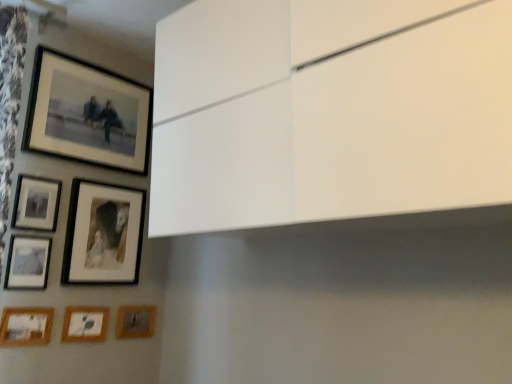
Question: Is matte black picture frame at upper left, the sixth picture frame ordered from the bottom, thinner than wooden matte picture frame at lower left, the second picture frame ordered from the bottom?

Choices:
 (A) yes
 (B) no

Answer: (B)

Question: Considering the relative positions of matte black picture frame at upper left, the sixth picture frame ordered from the bottom, and wooden matte picture frame at lower left, the second picture frame ordered from the bottom, in the image provided, is matte black picture frame at upper left, the sixth picture frame ordered from the bottom, to the right of wooden matte picture frame at lower left, the second picture frame ordered from the bottom, from the viewer's perspective?

Choices:
 (A) no
 (B) yes

Answer: (A)

Question: Is matte black picture frame at upper left, positioned as the second picture frame in top-to-bottom order, closer to the viewer compared to wooden matte picture frame at lower left, which ranks as the sixth picture frame in top-to-bottom order?

Choices:
 (A) no
 (B) yes

Answer: (B)

Question: Considering the relative sizes of matte black picture frame at upper left, the sixth picture frame ordered from the bottom, and wooden matte picture frame at lower left, which ranks as the sixth picture frame in top-to-bottom order, in the image provided, is matte black picture frame at upper left, the sixth picture frame ordered from the bottom, taller than wooden matte picture frame at lower left, which ranks as the sixth picture frame in top-to-bottom order,?

Choices:
 (A) no
 (B) yes

Answer: (B)

Question: Is the depth of matte black picture frame at upper left, positioned as the second picture frame in top-to-bottom order, greater than that of wooden matte picture frame at lower left, which ranks as the sixth picture frame in top-to-bottom order?

Choices:
 (A) no
 (B) yes

Answer: (A)

Question: From the image's perspective, is matte black picture frame at upper left, the sixth picture frame ordered from the bottom, located above or below wooden matte picture frame at lower left, which ranks as the sixth picture frame in top-to-bottom order?

Choices:
 (A) above
 (B) below

Answer: (A)

Question: Considering the positions of matte black picture frame at upper left, positioned as the second picture frame in top-to-bottom order, and wooden matte picture frame at lower left, the second picture frame ordered from the bottom, in the image, is matte black picture frame at upper left, positioned as the second picture frame in top-to-bottom order, taller or shorter than wooden matte picture frame at lower left, the second picture frame ordered from the bottom,?

Choices:
 (A) short
 (B) tall

Answer: (B)

Question: Which is correct: matte black picture frame at upper left, positioned as the second picture frame in top-to-bottom order, is inside wooden matte picture frame at lower left, which ranks as the sixth picture frame in top-to-bottom order, or outside of it?

Choices:
 (A) outside
 (B) inside

Answer: (A)

Question: Is matte black picture frame at upper left, positioned as the second picture frame in top-to-bottom order, wider or thinner than wooden matte picture frame at lower left, the second picture frame ordered from the bottom?

Choices:
 (A) thin
 (B) wide

Answer: (B)

Question: Based on their sizes in the image, would you say wooden photo frame at lower left, which is counted as the fifth picture frame, starting from the top, is bigger or smaller than matte black picture frame at upper left, the seventh picture frame positioned from the bottom?

Choices:
 (A) big
 (B) small

Answer: (B)

Question: From a real-world perspective, is wooden photo frame at lower left, which is counted as the fifth picture frame, starting from the top, positioned above or below matte black picture frame at upper left, marked as the first picture frame in a top-to-bottom arrangement?

Choices:
 (A) above
 (B) below

Answer: (B)

Question: Considering their positions, is wooden photo frame at lower left, acting as the third picture frame starting from the bottom, located in front of or behind matte black picture frame at upper left, the seventh picture frame positioned from the bottom?

Choices:
 (A) behind
 (B) front

Answer: (B)

Question: Does point (24, 327) appear closer or farther from the camera than point (122, 82)?

Choices:
 (A) farther
 (B) closer

Answer: (B)

Question: From the image's perspective, is matte black picture frame at lower left, the fourth picture frame from the top, located above or below wooden matte picture frame at lower left, the second picture frame ordered from the bottom?

Choices:
 (A) below
 (B) above

Answer: (B)

Question: From a real-world perspective, is matte black picture frame at lower left, acting as the 4th picture frame starting from the bottom, physically located above or below wooden matte picture frame at lower left, which ranks as the sixth picture frame in top-to-bottom order?

Choices:
 (A) above
 (B) below

Answer: (A)